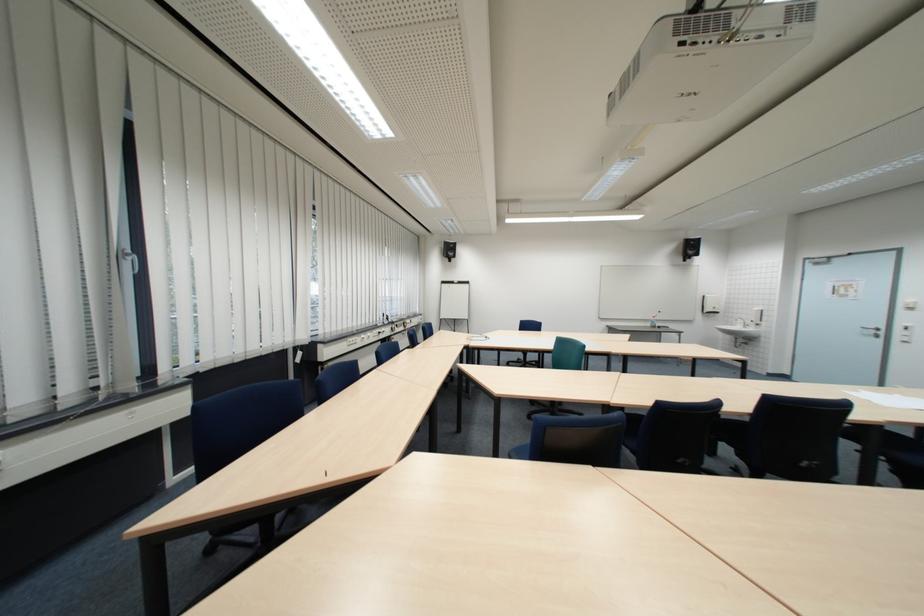
Find the location of `silver door handle`. silver door handle is located at coordinates (870, 331).